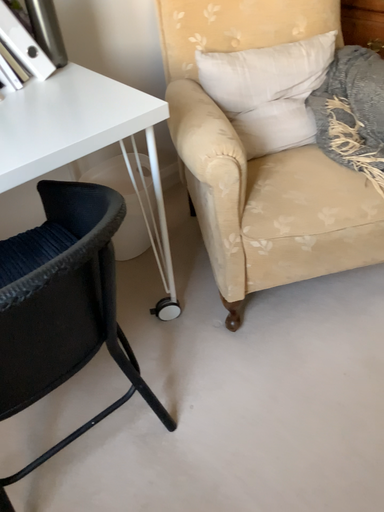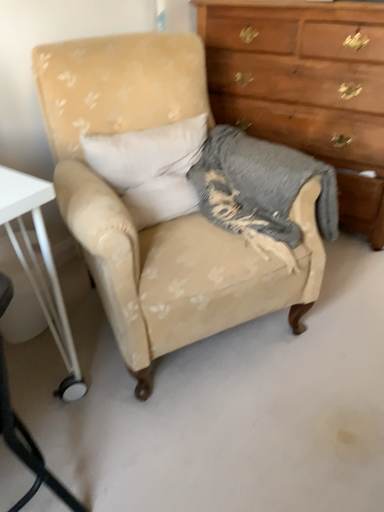
Question: How did the camera likely rotate when shooting the video?

Choices:
 (A) rotated right
 (B) rotated left

Answer: (A)